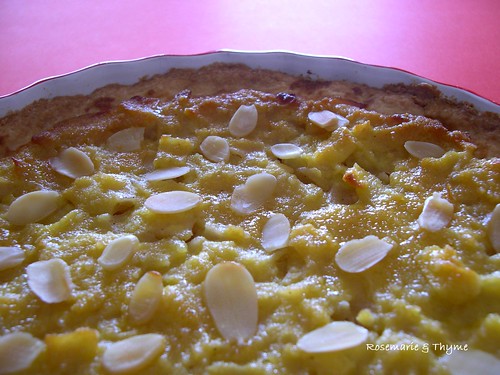
Where is `rim of pan`? This screenshot has height=375, width=500. rim of pan is located at coordinates (84, 76).